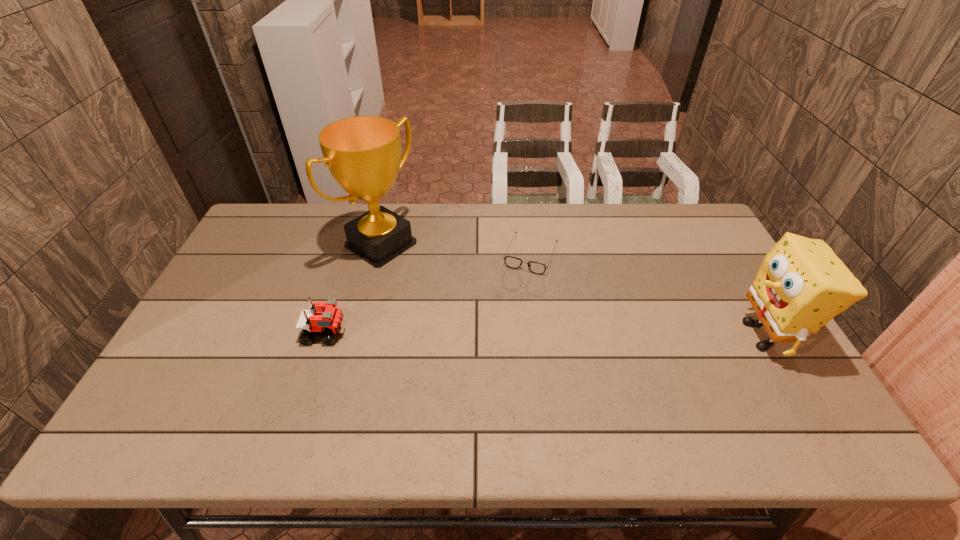
This screenshot has height=540, width=960. In order to click on free space on the desktop that is between the second shortest object and the rightmost object and is positioned on the front-facing side of the shortest object in this screenshot , I will do `click(499, 334)`.

Where is `vacant spot on the desktop that is between the Lego and the rightmost object and is positioned on the front-facing side of the award`? The height and width of the screenshot is (540, 960). vacant spot on the desktop that is between the Lego and the rightmost object and is positioned on the front-facing side of the award is located at coordinates (524, 334).